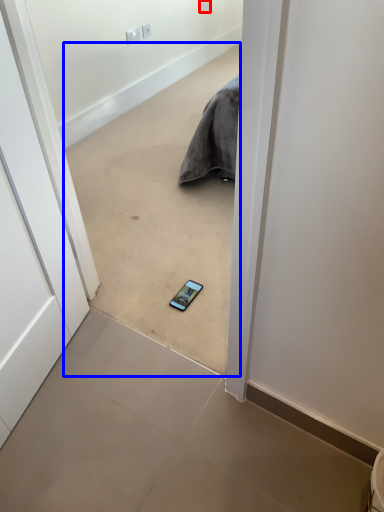
Question: Which object appears farthest to the camera in this image, electric outlet (highlighted by a red box) or concrete (highlighted by a blue box)?

Choices:
 (A) electric outlet
 (B) concrete

Answer: (A)